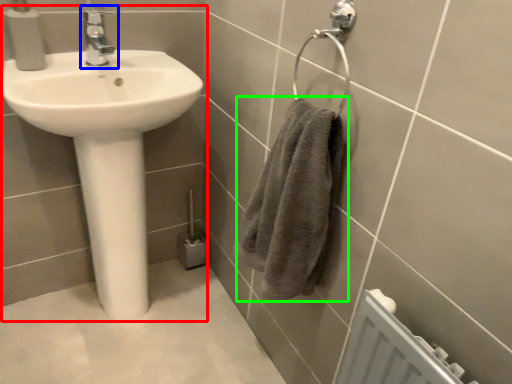
Question: Considering the real-world distances, which object is farthest from sink (highlighted by a red box)? tap (highlighted by a blue box) or bath towel (highlighted by a green box)?

Choices:
 (A) tap
 (B) bath towel

Answer: (B)